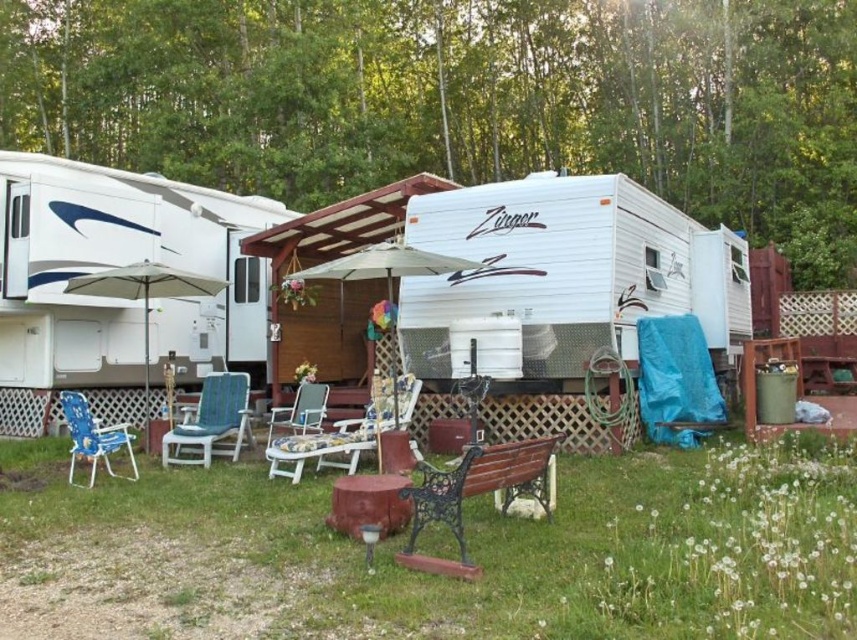
Between wooden bench at center and white matte camper at center, which one has less height?

With less height is wooden bench at center.

Is wooden bench at center positioned at the back of white matte camper at center?

No, it is in front of white matte camper at center.

Which is behind, point (816, 579) or point (590, 280)?

The point (590, 280) is behind.

I want to click on wooden bench at center, so click(469, 552).

Between white matte camper at center and blue fabric chair at center, which one has less height?

white matte camper at center is shorter.

Does white matte camper at center have a greater width compared to blue fabric chair at center?

No, white matte camper at center is not wider than blue fabric chair at center.

Is point (556, 305) farther from camera compared to point (244, 396)?

No, (556, 305) is closer to viewer.

The image size is (857, 640). I want to click on white matte camper at center, so click(568, 272).

Is blue fabric chair at center smaller than wooden chair at center?

No, blue fabric chair at center is not smaller than wooden chair at center.

Can you confirm if blue fabric chair at center is positioned to the right of wooden chair at center?

No, blue fabric chair at center is not to the right of wooden chair at center.

Which is in front, point (171, 451) or point (342, 422)?

Point (342, 422)

Where is `blue fabric chair at center`? blue fabric chair at center is located at coordinates (213, 422).